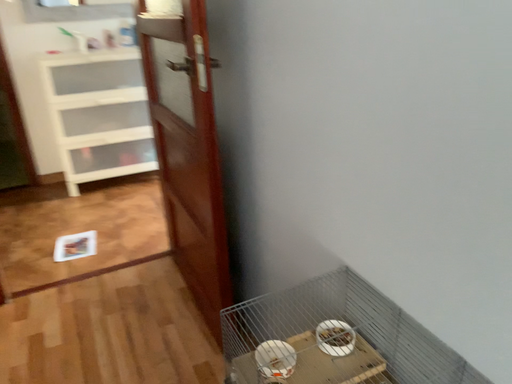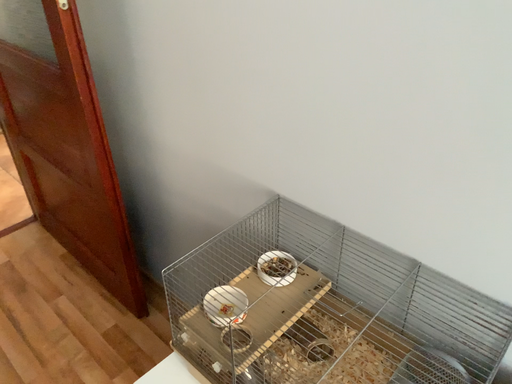
Question: Which way did the camera rotate in the video?

Choices:
 (A) rotated downward
 (B) rotated upward

Answer: (A)